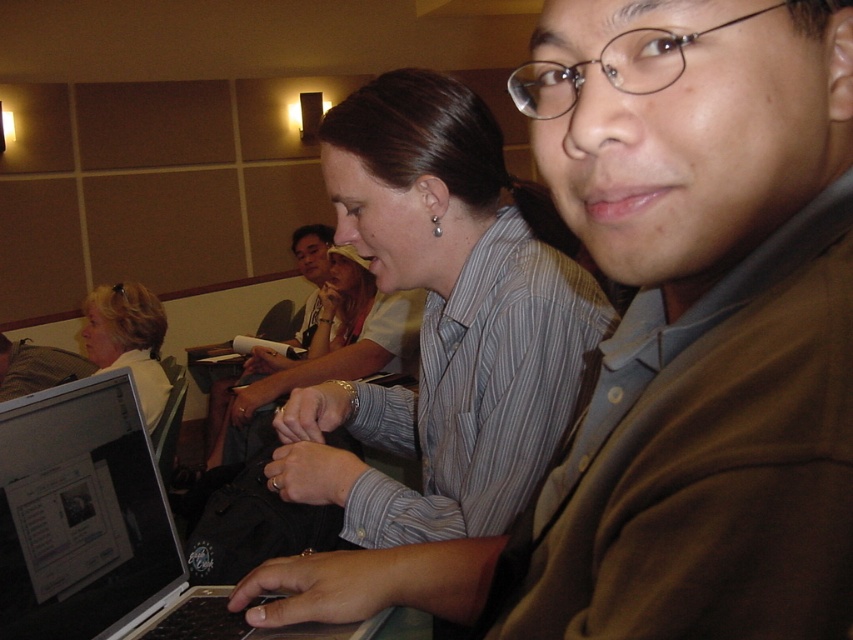
Question: Does brown cotton shirt at center come in front of metallic round glasses at upper right?

Choices:
 (A) no
 (B) yes

Answer: (B)

Question: Which of the following is the closest to the observer?

Choices:
 (A) (142, 404)
 (B) (142, 529)
 (C) (492, 234)

Answer: (C)

Question: Can you confirm if silver metallic laptop at center is thinner than matte white shirt at center?

Choices:
 (A) no
 (B) yes

Answer: (A)

Question: Does striped shirt at center appear under blonde hair at upper left?

Choices:
 (A) no
 (B) yes

Answer: (A)

Question: Which point is farther from the camera taking this photo?

Choices:
 (A) (15, 412)
 (B) (631, 49)

Answer: (A)

Question: Which of the following is the farthest from the observer?

Choices:
 (A) (614, 44)
 (B) (26, 486)
 (C) (294, 234)
 (D) (502, 307)

Answer: (C)